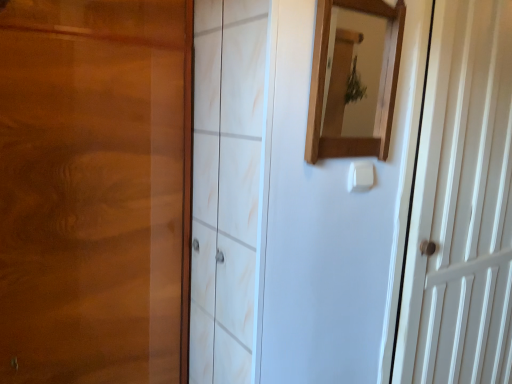
Measure the distance between point (354, 166) and camera.

They are 3.44 feet apart.

Measure the distance between white plastic light switch at center and camera.

white plastic light switch at center is 1.04 meters from camera.

Describe the element at coordinates (380, 92) in the screenshot. I see `wooden mirror at upper center` at that location.

Image resolution: width=512 pixels, height=384 pixels. I want to click on white plastic light switch at center, so click(360, 176).

Considering the sizes of objects white plastic light switch at center and wooden mirror at upper center in the image provided, who is thinner, white plastic light switch at center or wooden mirror at upper center?

white plastic light switch at center.

Is white plastic light switch at center in contact with wooden mirror at upper center?

No, white plastic light switch at center is not with wooden mirror at upper center.

From a real-world perspective, which object rests below the other?

white plastic light switch at center is physically lower.

Is white plastic light switch at center oriented towards wooden mirror at upper center?

No, white plastic light switch at center is not aimed at wooden mirror at upper center.

Visually, is wooden mirror at upper center positioned to the left or to the right of white wooden door at right?

Based on their positions, wooden mirror at upper center is located to the left of white wooden door at right.

Considering the relative sizes of wooden mirror at upper center and white wooden door at right in the image provided, is wooden mirror at upper center wider than white wooden door at right?

In fact, wooden mirror at upper center might be narrower than white wooden door at right.

Is white plastic light switch at center far from white wooden door at right?

No, there isn't a large distance between white plastic light switch at center and white wooden door at right.

From the image's perspective, who appears lower, white plastic light switch at center or white wooden door at right?

white wooden door at right.

What are the coordinates of `door below the white plastic light switch at center (from the image's perspective)` in the screenshot? It's located at (461, 205).

Does point (357, 167) appear closer or farther from the camera than point (447, 154)?

Point (357, 167).

Which object is further away from the camera, wooden mirror at upper center or white plastic light switch at center?

white plastic light switch at center is further away from the camera.

Are wooden mirror at upper center and white plastic light switch at center making contact?

No.

Looking at the image, does wooden mirror at upper center seem bigger or smaller compared to white plastic light switch at center?

Clearly, wooden mirror at upper center is larger in size than white plastic light switch at center.

In the scene shown: Between wooden mirror at upper center and white plastic light switch at center, which one has larger width?

wooden mirror at upper center.

Is white wooden door at right to the right of white plastic light switch at center from the viewer's perspective?

Yes, white wooden door at right is to the right of white plastic light switch at center.

Can we say white wooden door at right lies outside white plastic light switch at center?

Yes, white wooden door at right is located beyond the bounds of white plastic light switch at center.

Does white wooden door at right have a greater height compared to white plastic light switch at center?

Yes, white wooden door at right is taller than white plastic light switch at center.

Can you tell me how much white wooden door at right and white plastic light switch at center differ in facing direction?

0.102 degrees.

From the picture: How different are the orientations of white wooden door at right and wooden mirror at upper center in degrees?

The angle between the facing direction of white wooden door at right and the facing direction of wooden mirror at upper center is 1.94 degrees.

Does white wooden door at right have a larger size compared to wooden mirror at upper center?

Correct, white wooden door at right is larger in size than wooden mirror at upper center.

Is white wooden door at right oriented away from wooden mirror at upper center?

No, white wooden door at right's orientation is not away from wooden mirror at upper center.

Where is `door directly beneath the wooden mirror at upper center (from a real-world perspective)`? door directly beneath the wooden mirror at upper center (from a real-world perspective) is located at coordinates (461, 205).

At what (x,y) coordinates should I click in order to perform the action: click on light switch directly beneath the wooden mirror at upper center (from a real-world perspective). Please return your answer as a coordinate pair (x, y). This screenshot has height=384, width=512. Looking at the image, I should click on pos(360,176).

I want to click on mirror above the white wooden door at right (from a real-world perspective), so click(380, 92).

Looking at the image, which one is located closer to white wooden door at right, wooden mirror at upper center or white plastic light switch at center?

Among the two, wooden mirror at upper center is located nearer to white wooden door at right.

Which object lies nearer to the anchor point white plastic light switch at center, wooden mirror at upper center or white wooden door at right?

wooden mirror at upper center is positioned closer to the anchor white plastic light switch at center.

Estimate the real-world distances between objects in this image. Which object is closer to wooden mirror at upper center, white plastic light switch at center or white wooden door at right?

white plastic light switch at center is closer to wooden mirror at upper center.

Which object lies nearer to the anchor point white plastic light switch at center, white wooden door at right or wooden mirror at upper center?

wooden mirror at upper center is closer to white plastic light switch at center.

From the image, which object appears to be farther from white wooden door at right, white plastic light switch at center or wooden mirror at upper center?

white plastic light switch at center.

Which object lies nearer to the anchor point wooden mirror at upper center, white wooden door at right or white plastic light switch at center?

Based on the image, white plastic light switch at center appears to be nearer to wooden mirror at upper center.

Where is `light switch between wooden mirror at upper center and white wooden door at right`? The image size is (512, 384). light switch between wooden mirror at upper center and white wooden door at right is located at coordinates (360, 176).